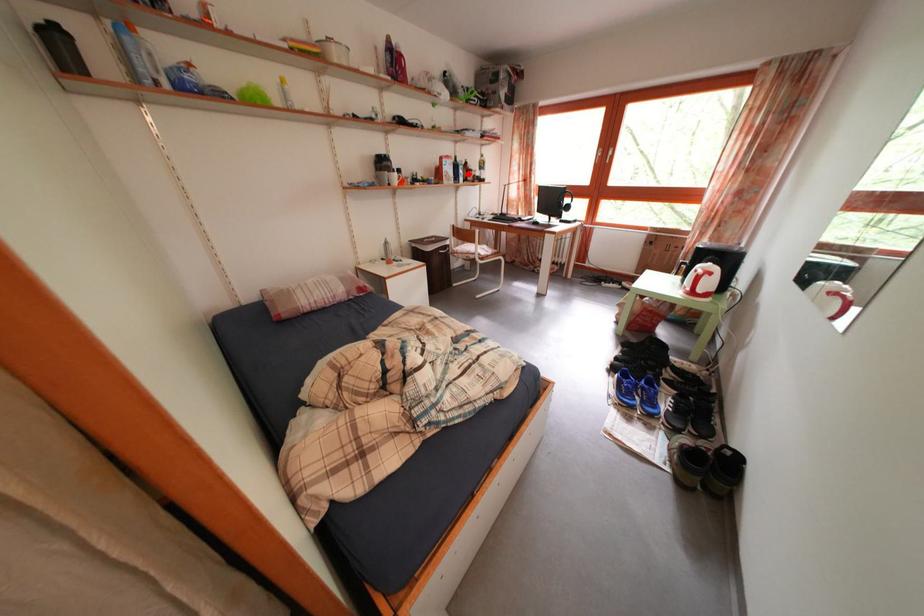
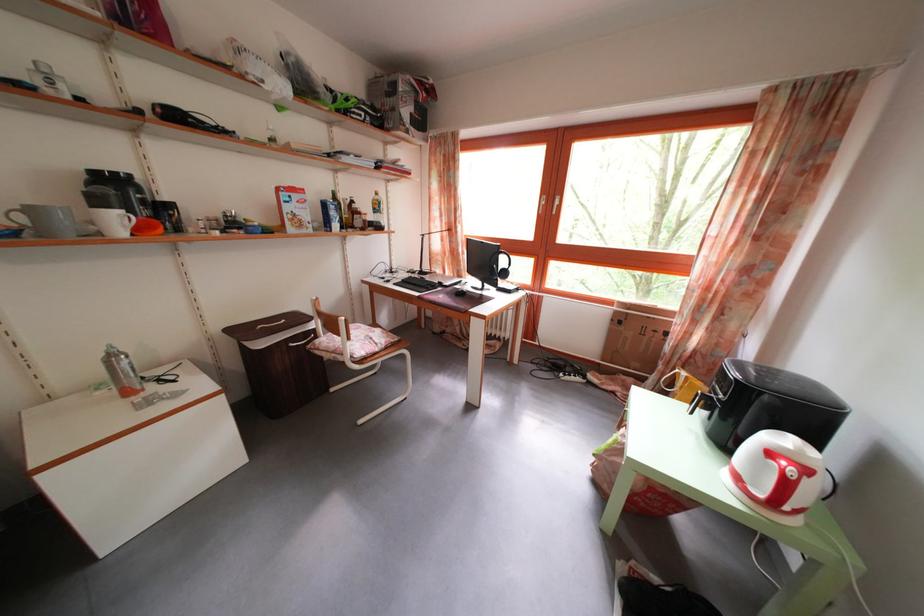
Question: I am providing you with two images of the same scene from different viewpoints. In image1, a red point is highlighted. Considering the same 3D point in image2, which of the following is correct?

Choices:
 (A) It is closer
 (B) It is farther

Answer: (B)